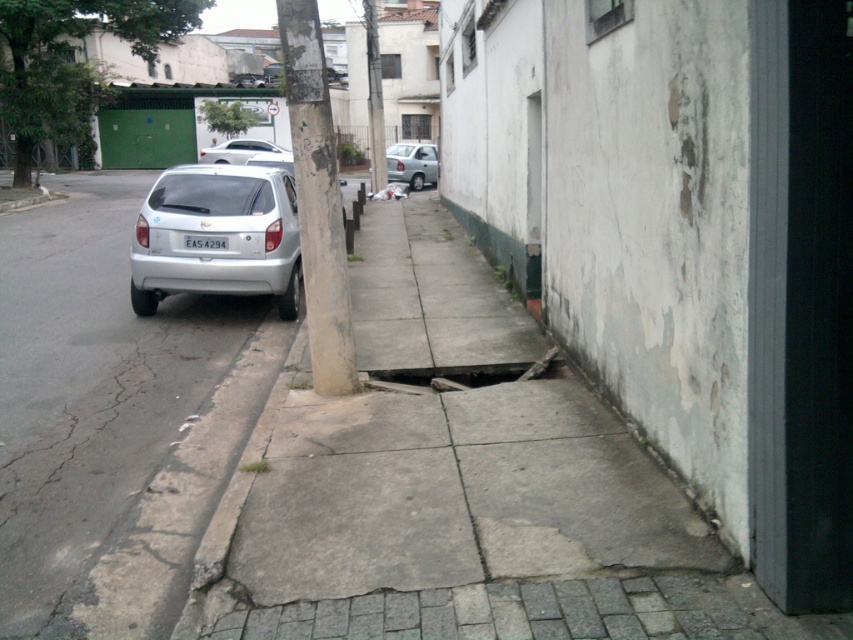
This screenshot has width=853, height=640. What are the coordinates of `green leafy tree at upper left` in the screenshot? It's located at (71, 61).

Looking at this image, does green leafy tree at upper left have a greater width compared to green leafy tree at upper center?

Indeed, green leafy tree at upper left has a greater width compared to green leafy tree at upper center.

Is point (12, 113) positioned before point (241, 108)?

Yes.

What are the coordinates of `green leafy tree at upper left` in the screenshot? It's located at (71, 61).

Measure the distance from white matte hatchback at center-left to smooth concrete pole at center.

white matte hatchback at center-left is 20.91 meters from smooth concrete pole at center.

Consider the image. Is white matte hatchback at center-left thinner than smooth concrete pole at center?

Yes.

The height and width of the screenshot is (640, 853). What do you see at coordinates (218, 236) in the screenshot? I see `white matte hatchback at center-left` at bounding box center [218, 236].

You are a GUI agent. You are given a task and a screenshot of the screen. Output one action in this format:
    pyautogui.click(x=<x>, y=<y>)
    Task: Click on the white matte hatchback at center-left
    This screenshot has width=853, height=640.
    Given the screenshot: What is the action you would take?
    pyautogui.click(x=218, y=236)

Is point (21, 17) farther from viewer compared to point (398, 380)?

Yes, point (21, 17) is farther from viewer.

Between point (21, 136) and point (483, 369), which one is positioned behind?

The point (21, 136) is more distant.

Find the location of a particular element. green leafy tree at upper left is located at coordinates (71, 61).